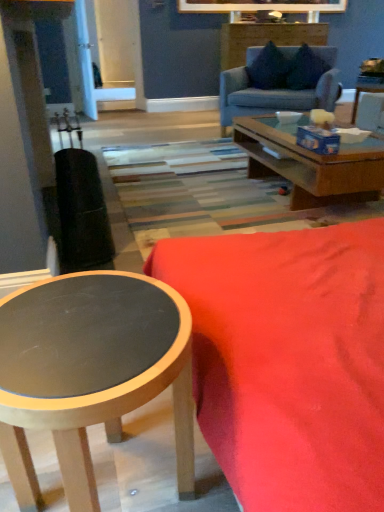
At what (x,y) coordinates should I click in order to perform the action: click on free spot above matte black coffee table at lower left (from a real-world perspective). Please return your answer as a coordinate pair (x, y). Looking at the image, I should click on (90, 322).